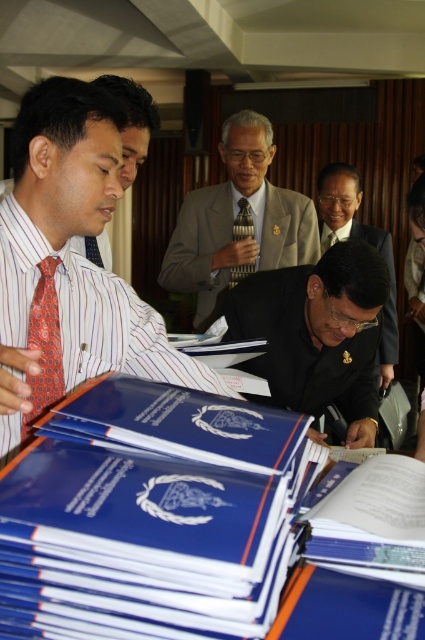
Question: Which of the following is the closest to the observer?

Choices:
 (A) light beige suit at center
 (B) matte striped shirt at left
 (C) striped silk tie at center
 (D) blue hardcover book at center

Answer: (D)

Question: Is black glossy suit at center positioned behind light beige suit at center?

Choices:
 (A) no
 (B) yes

Answer: (A)

Question: Which is nearer to the light beige suit at center?

Choices:
 (A) striped silk tie at center
 (B) orange patterned tie at left
 (C) blue hardcover book at center
 (D) matte striped shirt at left

Answer: (A)

Question: Can you confirm if matte black suit at center is wider than orange patterned tie at left?

Choices:
 (A) yes
 (B) no

Answer: (A)

Question: Is black glossy suit at center positioned in front of red silk tie at left?

Choices:
 (A) yes
 (B) no

Answer: (A)

Question: Which object appears farthest from the camera in this image?

Choices:
 (A) red silk tie at left
 (B) striped silk tie at center
 (C) blue hardcover book at center
 (D) orange patterned tie at left

Answer: (B)